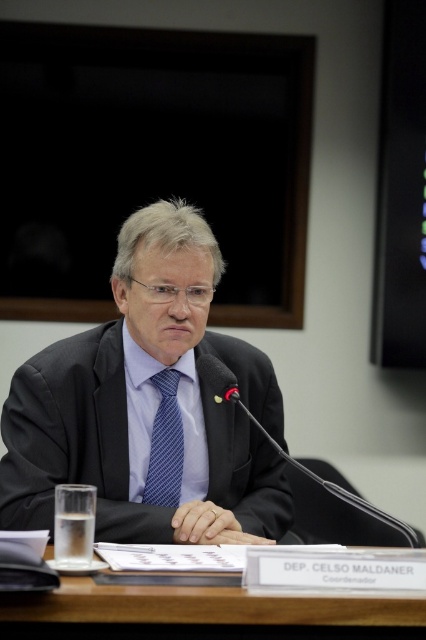
Question: Where is matte black suit at center located in relation to brown wooden table at center in the image?

Choices:
 (A) above
 (B) below

Answer: (A)

Question: Among these points, which one is farthest from the camera?

Choices:
 (A) (58, 593)
 (B) (154, 477)

Answer: (B)

Question: Does matte black suit at center lie behind brown wooden table at center?

Choices:
 (A) no
 (B) yes

Answer: (B)

Question: Which point appears closest to the camera in this image?

Choices:
 (A) (160, 442)
 (B) (48, 364)

Answer: (B)

Question: Observing the image, what is the correct spatial positioning of brown wooden table at center in reference to blue striped tie at center?

Choices:
 (A) above
 (B) below

Answer: (B)

Question: Among these points, which one is nearest to the camera?

Choices:
 (A) coord(195,632)
 (B) coord(146,284)
 (C) coord(161,461)

Answer: (A)